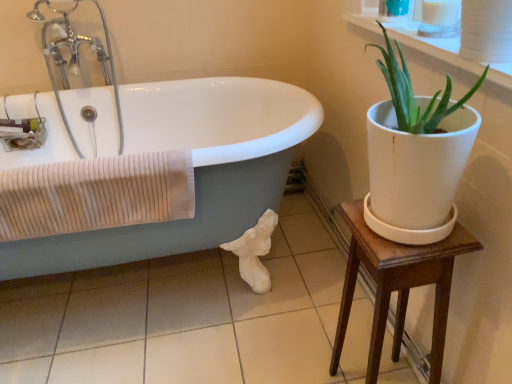
Where is `free region under white glossy bathtub at left (from a real-world perspective)`? The height and width of the screenshot is (384, 512). free region under white glossy bathtub at left (from a real-world perspective) is located at coordinates (136, 296).